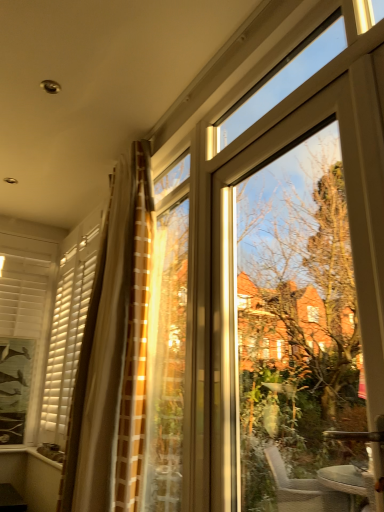
What is the approximate height of white textured blinds at left?

5.03 feet.

This screenshot has width=384, height=512. What do you see at coordinates (25, 327) in the screenshot? I see `white textured blinds at left` at bounding box center [25, 327].

Identify the location of white textured blinds at left. 25,327.

The width and height of the screenshot is (384, 512). I want to click on white textured blinds at left, so click(25, 327).